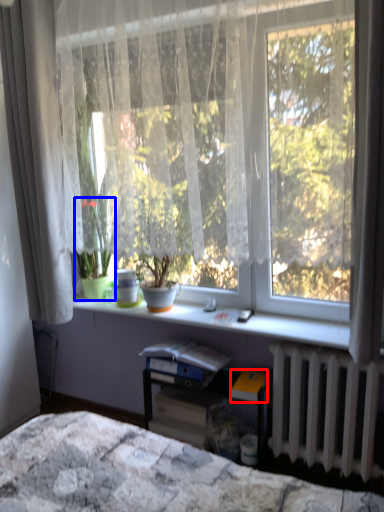
Question: Which object appears closest to the camera in this image, paperback book (highlighted by a red box) or houseplant (highlighted by a blue box)?

Choices:
 (A) paperback book
 (B) houseplant

Answer: (A)